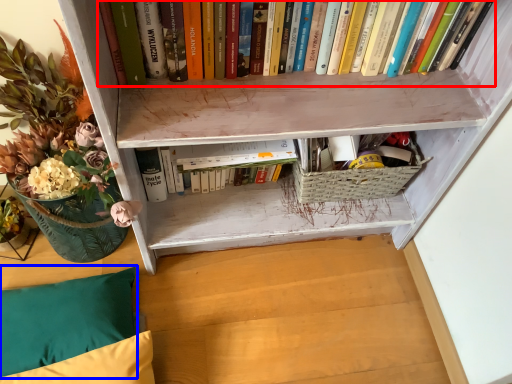
Question: Among these objects, which one is farthest to the camera, book (highlighted by a red box) or pillow (highlighted by a blue box)?

Choices:
 (A) book
 (B) pillow

Answer: (B)